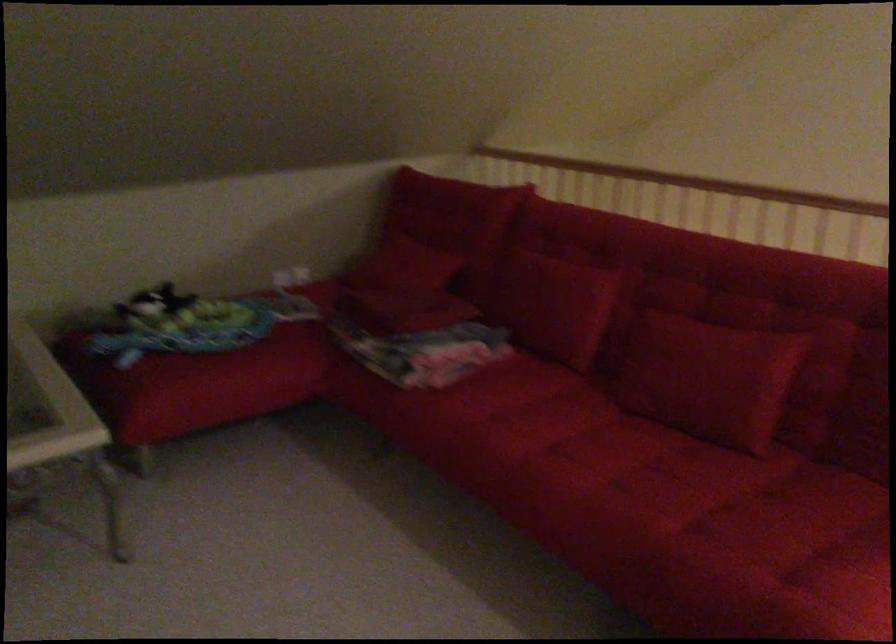
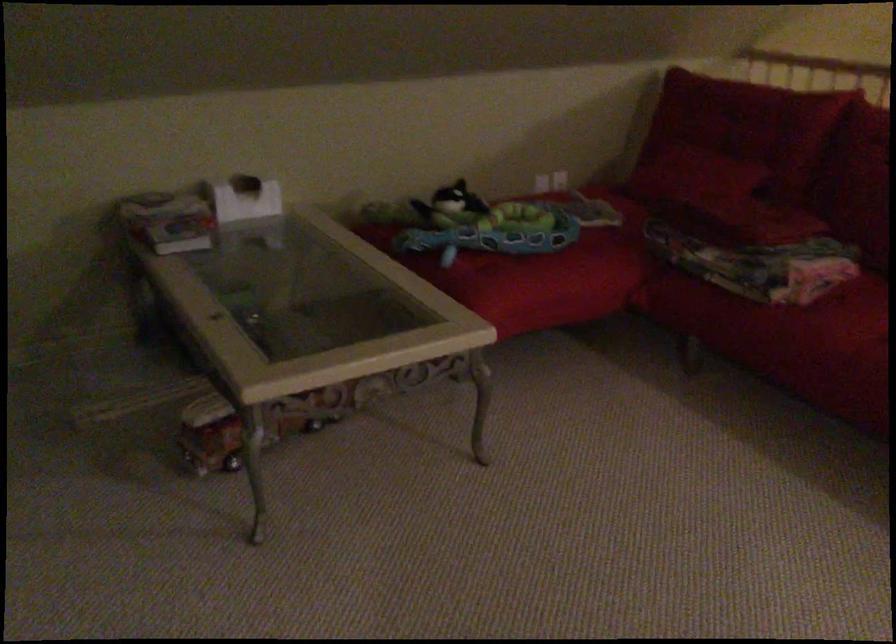
Where in the second image is the point corresponding to point (461, 397) from the first image?

(843, 317)